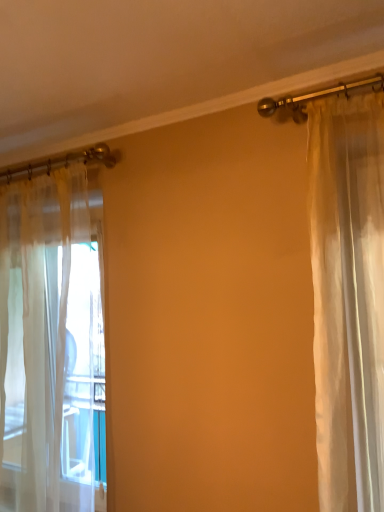
Question: Should I look upward or downward to see sheer white curtain at left?

Choices:
 (A) down
 (B) up

Answer: (A)